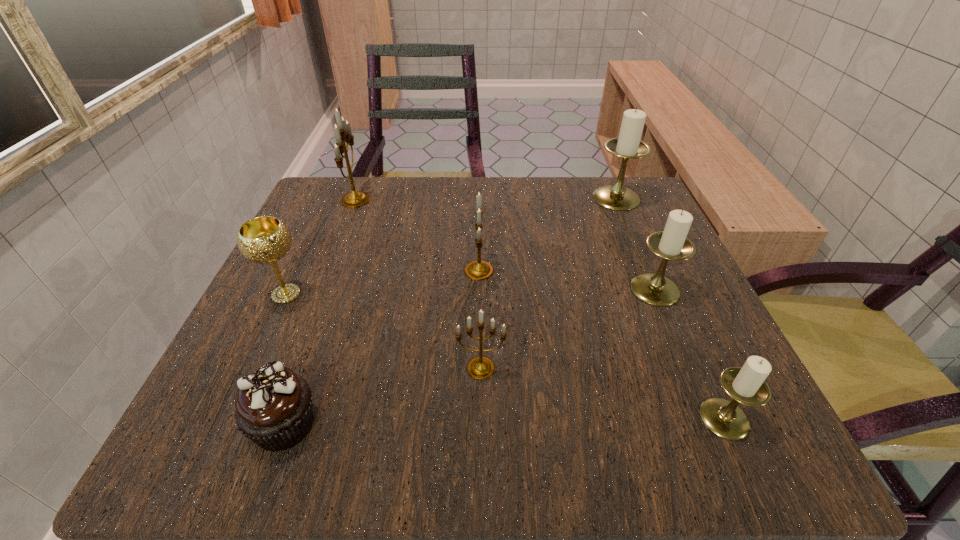
At what (x,y) coordinates should I click in order to perform the action: click on candle holder located at the near edge. Please return your answer as a coordinate pair (x, y). Looking at the image, I should click on (747, 385).

What are the coordinates of `cupcake that is at the near edge` in the screenshot? It's located at (273, 405).

At what (x,y) coordinates should I click in order to perform the action: click on candelabrum located at the left edge. Please return your answer as a coordinate pair (x, y). The width and height of the screenshot is (960, 540). Looking at the image, I should click on coord(342,130).

What are the coordinates of `chalice at the left edge` in the screenshot? It's located at (266, 239).

Where is `cupcake located in the left edge section of the desktop`? The height and width of the screenshot is (540, 960). cupcake located in the left edge section of the desktop is located at coordinates pos(273,405).

The width and height of the screenshot is (960, 540). What are the coordinates of `object situated at the far left corner` in the screenshot? It's located at (342, 130).

Identify the location of object that is at the near left corner. The height and width of the screenshot is (540, 960). (273, 405).

The height and width of the screenshot is (540, 960). In order to click on object present at the far right corner in this screenshot , I will do `click(628, 145)`.

This screenshot has height=540, width=960. I want to click on object that is at the near right corner, so tap(747, 385).

The width and height of the screenshot is (960, 540). What are the coordinates of `vacant space at the far edge` in the screenshot? It's located at (542, 201).